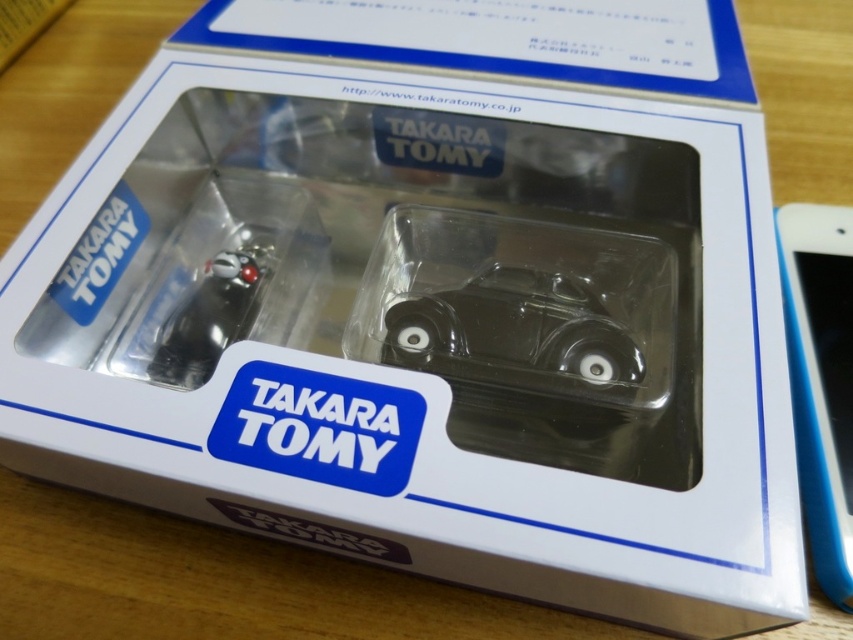
Can you confirm if transparent plastic car at center is wider than shiny black car at center?

Yes, transparent plastic car at center is wider than shiny black car at center.

Is transparent plastic car at center positioned behind shiny black car at center?

No, transparent plastic car at center is closer to the viewer.

Between point (474, 380) and point (254, 252), which one is positioned in front?

Positioned in front is point (474, 380).

At what (x,y) coordinates should I click in order to perform the action: click on transparent plastic car at center. Please return your answer as a coordinate pair (x, y). Looking at the image, I should click on (515, 333).

Which is more to the left, blue glossy smartphone at right or shiny black car at center?

shiny black car at center is more to the left.

Can you confirm if blue glossy smartphone at right is wider than shiny black car at center?

Correct, the width of blue glossy smartphone at right exceeds that of shiny black car at center.

Is point (833, 300) more distant than point (202, 304)?

No.

Where is `blue glossy smartphone at right`? blue glossy smartphone at right is located at coordinates (821, 380).

Which is behind, point (416, 308) or point (798, 365)?

The point (416, 308) is more distant.

Who is higher up, transparent plastic car at center or blue glossy smartphone at right?

Positioned higher is transparent plastic car at center.

Where is `transparent plastic car at center`? transparent plastic car at center is located at coordinates (515, 333).